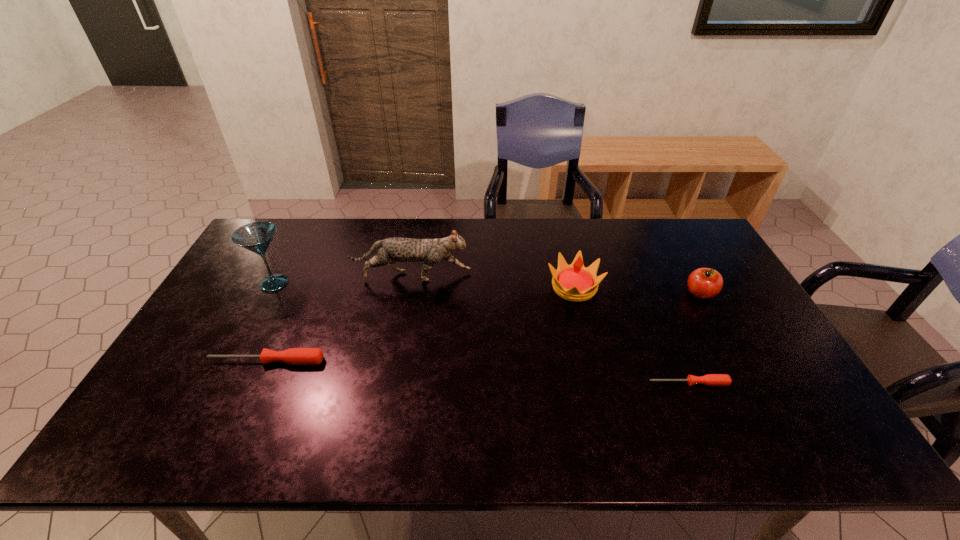
Where is `unoccupied position between the martini and the cat`? unoccupied position between the martini and the cat is located at coordinates (343, 280).

Locate an element on the screen. vacant region between the martini and the shortest object is located at coordinates (481, 333).

Locate an element on the screen. The height and width of the screenshot is (540, 960). vacant area that lies between the cat and the third object from right to left is located at coordinates [492, 282].

At what (x,y) coordinates should I click in order to perform the action: click on vacant space that is in between the crown and the cat. Please return your answer as a coordinate pair (x, y). Image resolution: width=960 pixels, height=540 pixels. Looking at the image, I should click on (492, 282).

In order to click on free point between the third object from right to left and the martini in this screenshot , I will do `click(424, 285)`.

The width and height of the screenshot is (960, 540). In order to click on object that ranks as the closest to the third shortest object in this screenshot , I will do `click(575, 282)`.

Identify which object is the fourth closest to the farther screwdriver. Please provide its 2D coordinates. Your answer should be formatted as a tuple, i.e. [(x, y)], where the tuple contains the x and y coordinates of a point satisfying the conditions above.

[(710, 379)]

Locate an element on the screen. vacant point that satisfies the following two spatial constraints: 1. on the face of the rightmost object; 2. on the right side of the cat is located at coordinates (408, 293).